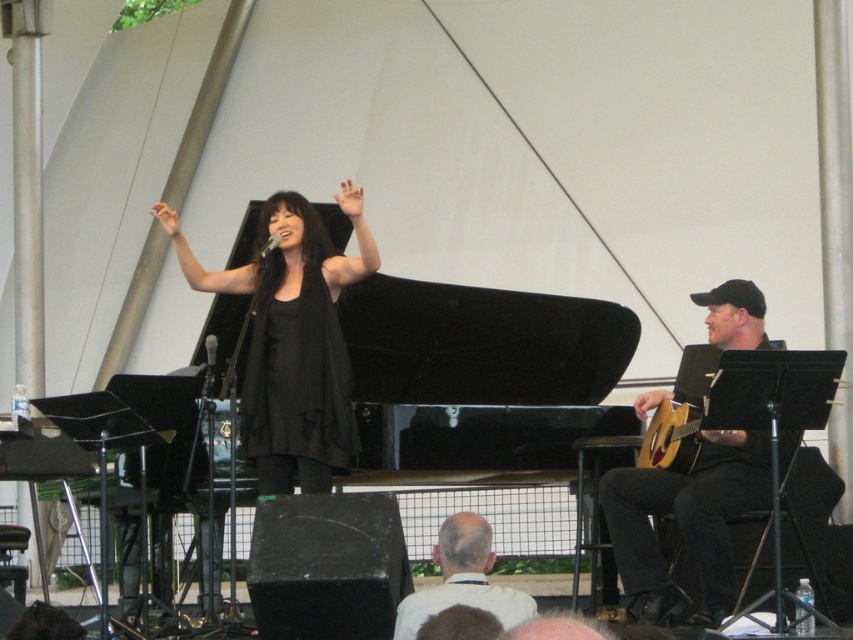
You are a photographer at the live performance. You want to capture a photo where both the black matte dress at center and the black acoustic guitar at right are visible. Considering their heights, which object will appear taller in the photo?

The black matte dress at center will appear taller in the photo because it has a greater height compared to the black acoustic guitar at right.

You are a photographer at the live performance. You want to capture a photo where both the black matte dress at center and the acoustic wood guitar at right are clearly visible. Given their sizes, which object should you ensure is closer to the camera to maintain clarity in the photo?

The black matte dress at center is larger than the acoustic wood guitar at right. To maintain clarity, the acoustic wood guitar at right should be closer to the camera since smaller objects need to be nearer to the lens to appear clear in the photo.

Looking at this image, you are a stagehand who needs to move a 2.5 meter long ladder from the black matte dress at center to the black acoustic guitar at right. Can you move the ladder horizontally without tilting it?

The distance between the black matte dress at center and the black acoustic guitar at right is 2.40 meters. Since the ladder is 2.5 meters long, it cannot be moved horizontally without tilting as it is longer than the available space between them.